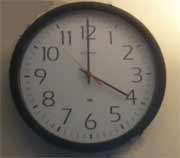
At what (x,y) coordinates should I click in order to perform the action: click on shadow under clock. Please return your answer as a coordinate pair (x, y). The width and height of the screenshot is (180, 158). Looking at the image, I should click on (106, 154).